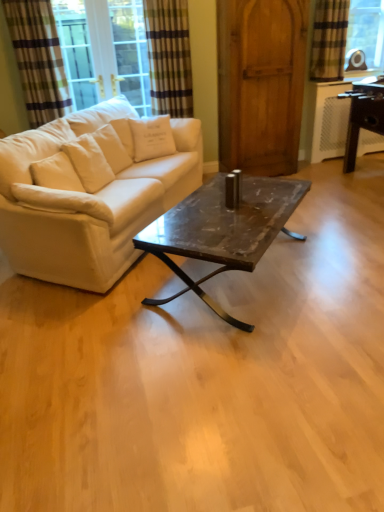
I want to click on spots to the right of marble/black metal coffee table at center, so click(x=326, y=259).